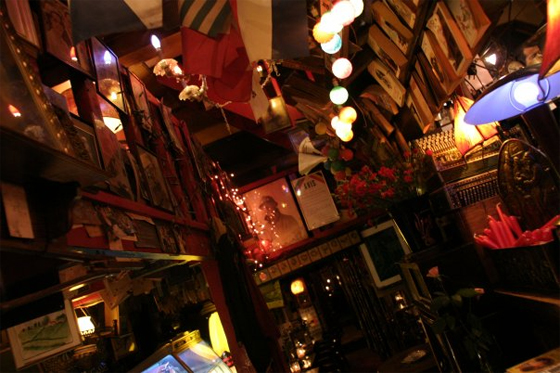
At what (x,y) coordinates should I click in order to perform the action: click on black frame. Please return your answer as a coordinate pair (x, y). This screenshot has height=373, width=560. Looking at the image, I should click on (288, 181).